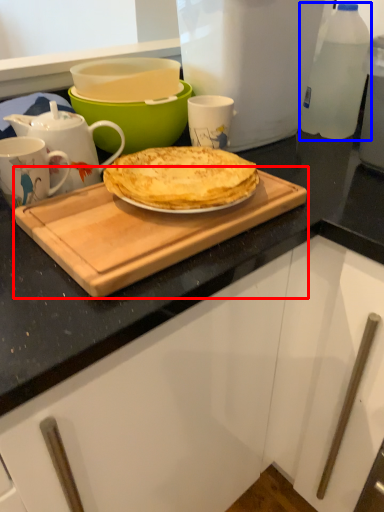
Question: Which object appears closest to the camera in this image, cutting board (highlighted by a red box) or bottle (highlighted by a blue box)?

Choices:
 (A) cutting board
 (B) bottle

Answer: (A)